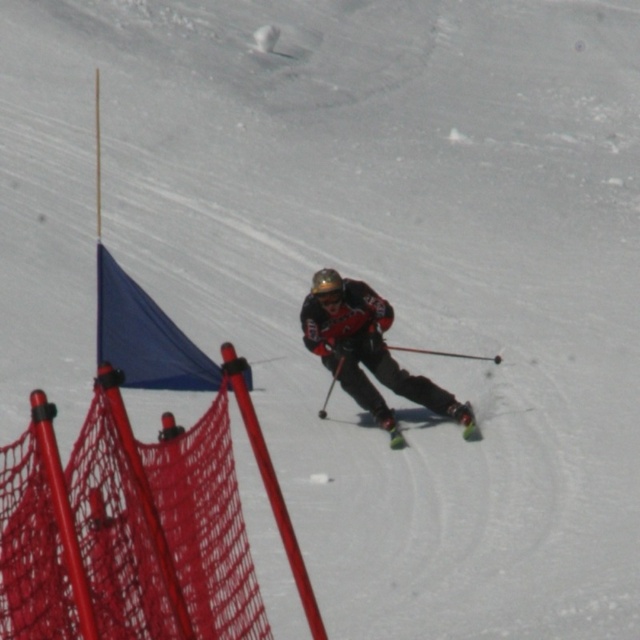
You are a safety inspector checking the equipment of a skier. You need to ensure that the matte black ski suit at center and the green matte ski at center are within a 36 inches safety distance. Is the current distance compliant with the safety regulations?

The distance between the matte black ski suit at center and the green matte ski at center is 33.12 inches, which is within the 36 inches safety regulation. Therefore, the current distance is compliant.

You are a photographer trying to capture the skier in the image. You want to position your camera so that the matte black ski suit at center is visible to the left of the green matte ski at center. Is this possible given their arrangement?

Yes, the matte black ski suit at center is already positioned to the left of the green matte ski at center, so the camera can capture them in that arrangement.